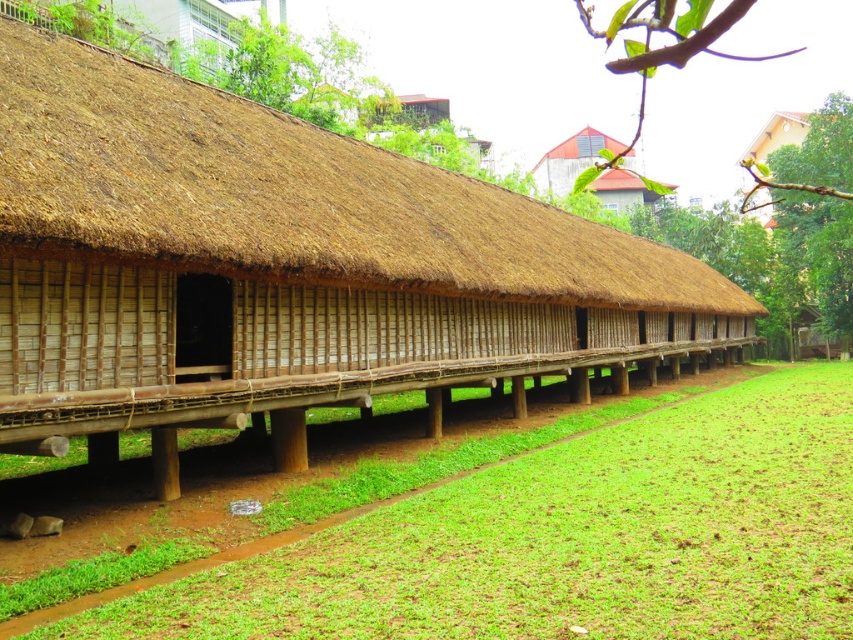
Question: Is the position of brown thatch roof at center more distant than that of green grass at lower center?

Choices:
 (A) yes
 (B) no

Answer: (A)

Question: Which point is farther to the camera?

Choices:
 (A) green grass at lower center
 (B) brown thatch roof at center

Answer: (B)

Question: Which of the following is the farthest from the observer?

Choices:
 (A) green grass at lower center
 (B) matte brown thatched roof hut at upper center
 (C) brown thatch roof at center

Answer: (C)

Question: Does green grass at lower center have a smaller size compared to matte brown thatched roof hut at upper center?

Choices:
 (A) yes
 (B) no

Answer: (A)

Question: Among these objects, which one is farthest from the camera?

Choices:
 (A) brown thatch roof at center
 (B) green grass at lower center

Answer: (A)

Question: Does brown thatch roof at center come behind matte brown thatched roof hut at upper center?

Choices:
 (A) no
 (B) yes

Answer: (B)